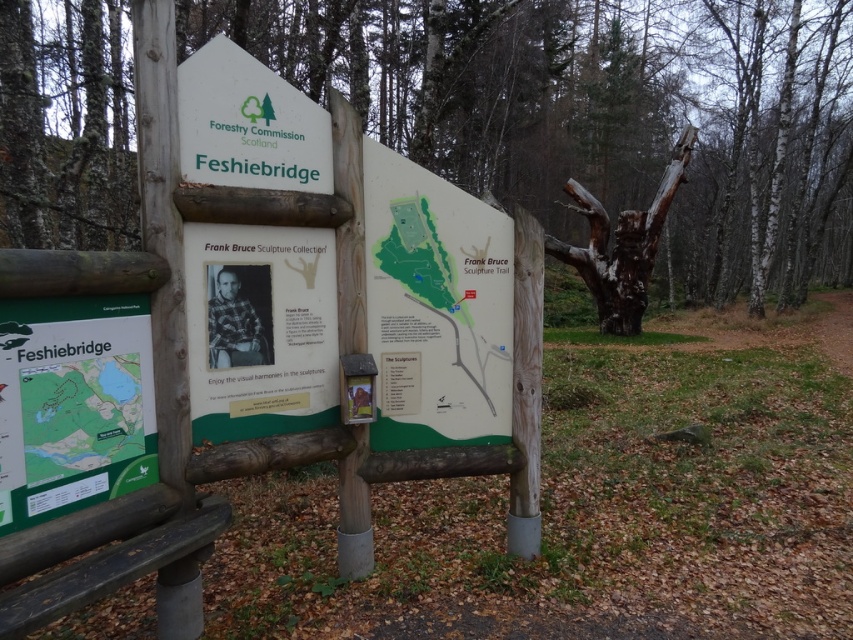
Between point (51, 326) and point (219, 152), which one is positioned behind?

Positioned behind is point (219, 152).

Which is more to the right, green matte map at lower left or white plastic sign at upper center?

white plastic sign at upper center

I want to click on green matte map at lower left, so [x=73, y=404].

The height and width of the screenshot is (640, 853). Find the location of `green matte map at lower left`. green matte map at lower left is located at coordinates (73, 404).

Which is behind, point (260, 317) or point (224, 525)?

The point (260, 317) is behind.

Between point (329, 305) and point (99, 568), which one is positioned in front?

Point (99, 568) is more forward.

Find the location of a particular element. The height and width of the screenshot is (640, 853). green matte sign at center is located at coordinates (260, 328).

Can you confirm if green matte map at lower left is shorter than dark gray wood bench at lower left?

Incorrect, green matte map at lower left's height does not fall short of dark gray wood bench at lower left's.

Between point (102, 422) and point (4, 620), which one is positioned in front?

Point (4, 620)

Find the location of a particular element. Image resolution: width=853 pixels, height=640 pixels. green matte map at lower left is located at coordinates pos(73,404).